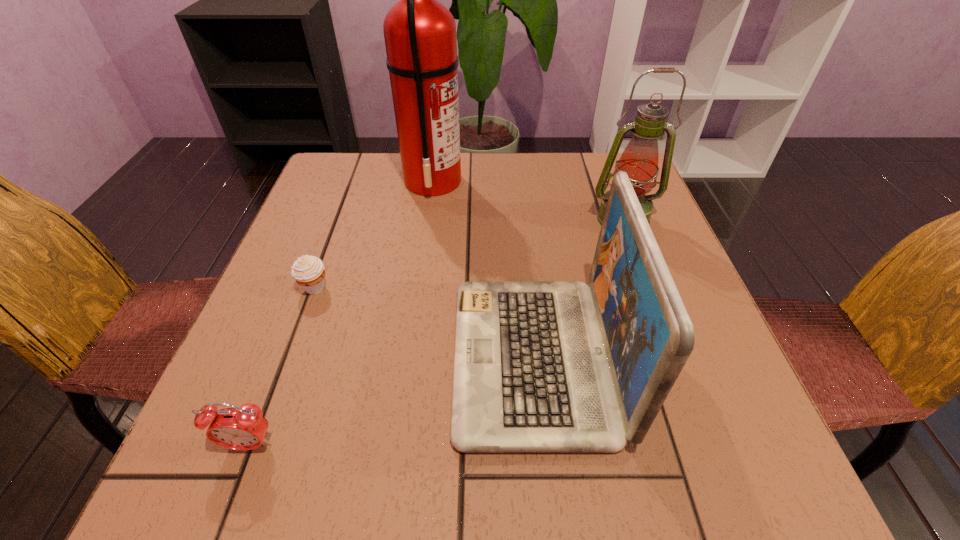
Choose which object is the nearest neighbor to the fire extinguisher. Please provide its 2D coordinates. Your answer should be formatted as a tuple, i.e. [(x, y)], where the tuple contains the x and y coordinates of a point satisfying the conditions above.

[(308, 271)]

The width and height of the screenshot is (960, 540). Identify the location of vacant space that satisfies the following two spatial constraints: 1. at the nozzle of the tallest object; 2. on the face of the alarm clock. (396, 445).

The height and width of the screenshot is (540, 960). Identify the location of vacant space that satisfies the following two spatial constraints: 1. at the nozzle of the fire extinguisher; 2. on the front side of the muffin. (419, 288).

Find the location of a particular element. free location that satisfies the following two spatial constraints: 1. on the screen of the fourth object from left to right; 2. on the face of the fourth tallest object is located at coordinates (543, 445).

At what (x,y) coordinates should I click in order to perform the action: click on free spot that satisfies the following two spatial constraints: 1. on the screen of the laptop computer; 2. on the face of the alarm clock. Please return your answer as a coordinate pair (x, y). Looking at the image, I should click on (543, 445).

I want to click on free space that satisfies the following two spatial constraints: 1. on the screen of the second object from right to left; 2. on the face of the alarm clock, so click(543, 445).

Locate an element on the screen. The width and height of the screenshot is (960, 540). free point that satisfies the following two spatial constraints: 1. at the nozzle of the tallest object; 2. on the face of the alarm clock is located at coordinates click(396, 445).